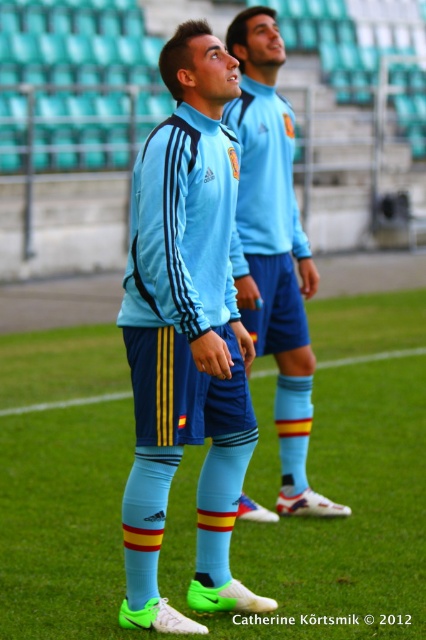
You are a soccer coach observing the two players in the image. You notice both the light blue fabric socks at center and the blue matte soccer uniform at center. Which of these items has a narrower width?

The light blue fabric socks at center has a lesser width compared to the blue matte soccer uniform at center, so the light blue fabric socks at center is narrower.

You are a soccer coach analyzing the positioning of players during a training session. You notice the light blue matte jersey at center on the field. Based on the coordinates provided, can you determine if this jersey is positioned closer to the center of the field or towards one of the sidelines?

The light blue matte jersey at center is located at point (186, 337). Since the coordinates are close to 0.5 on both axes, the jersey is positioned near the center of the field.